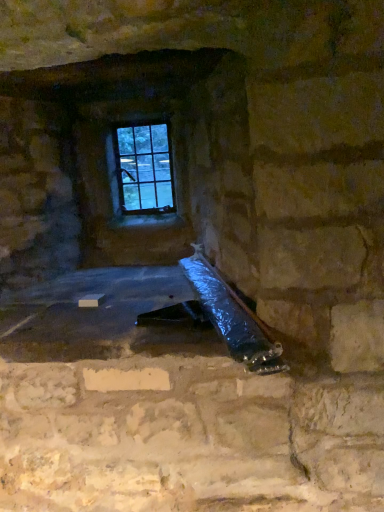
Where is `clear glass window at upper center`? clear glass window at upper center is located at coordinates (143, 166).

This screenshot has width=384, height=512. What do you see at coordinates (143, 166) in the screenshot?
I see `clear glass window at upper center` at bounding box center [143, 166].

Locate an element on the screen. This screenshot has height=512, width=384. clear glass window at upper center is located at coordinates (143, 166).